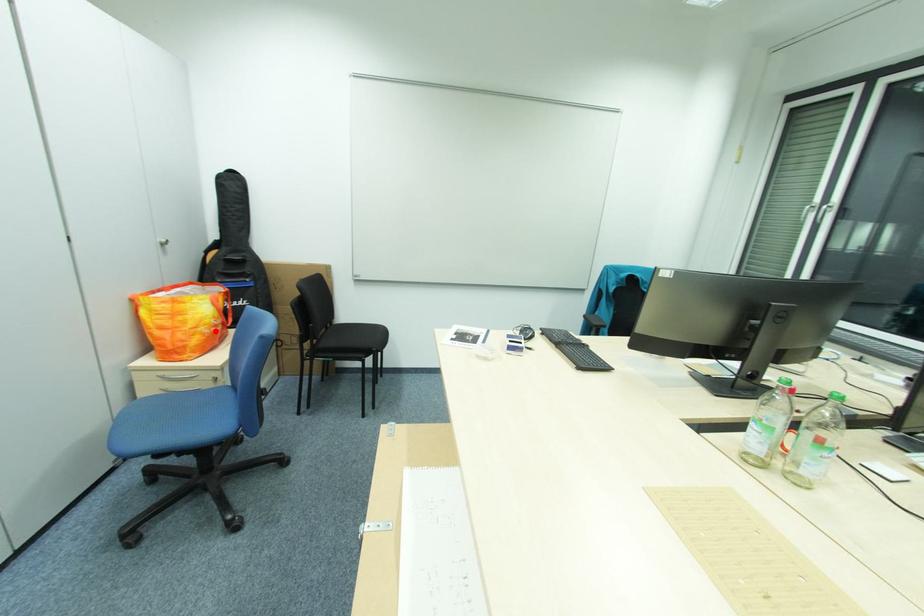
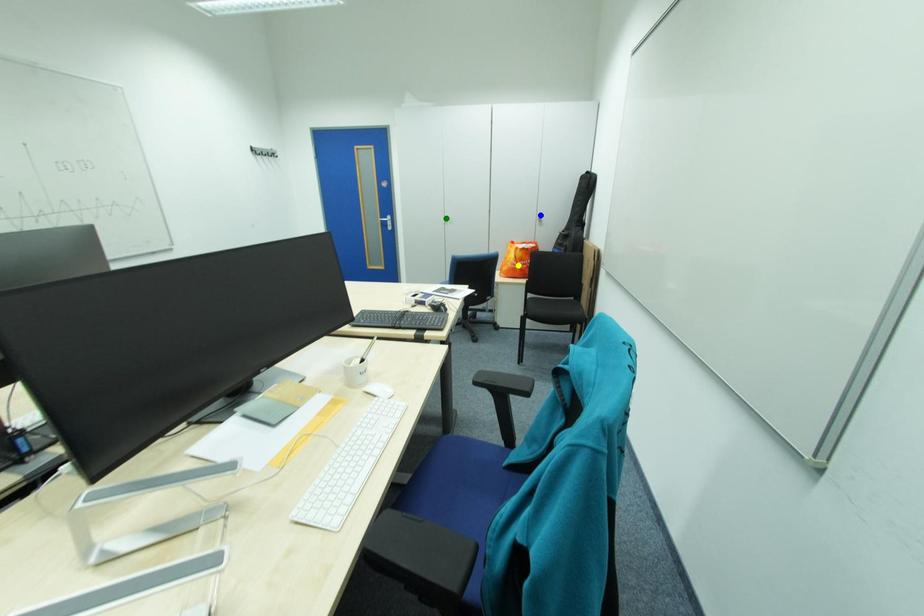
Question: I am providing you with two images of the same scene from different viewpoints. A red point is marked on the first image. You are given multiple points on the second image. Which point in image 2 is actually the same real-world point as the red point in image 1?

Choices:
 (A) yellow point
 (B) green point
 (C) blue point

Answer: (A)